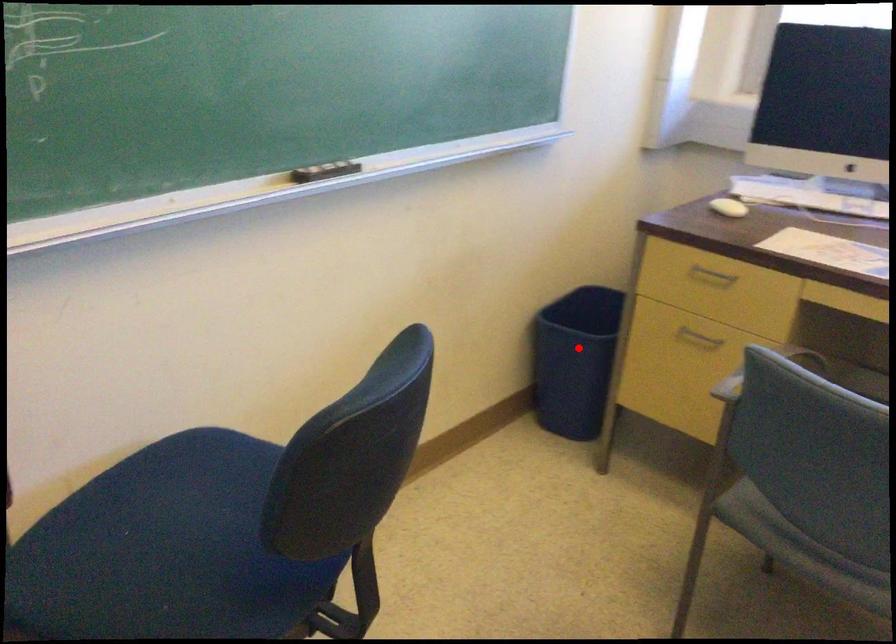
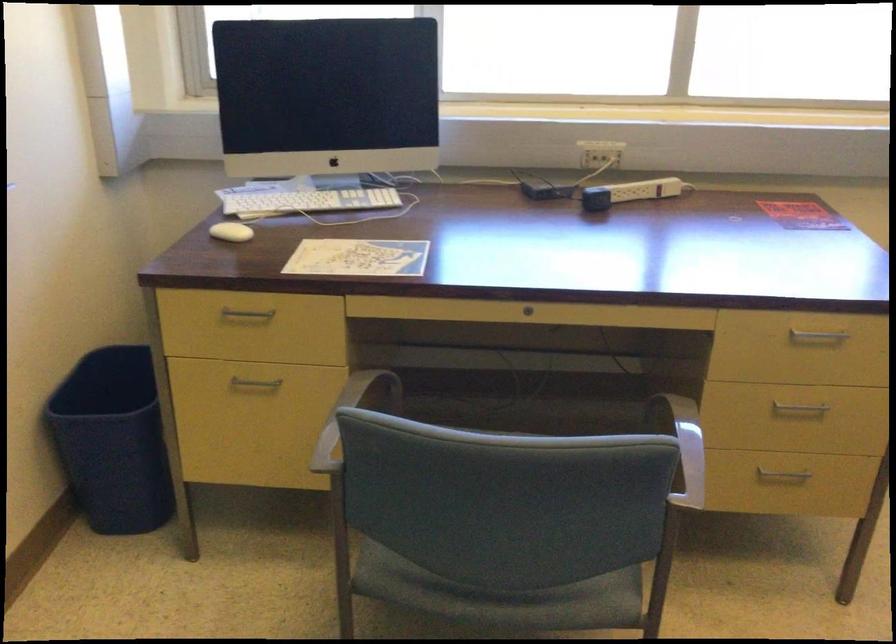
Question: A red point is marked in image1. In image2, is the corresponding 3D point closer to the camera or farther? Reply with the corresponding letter.

Choices:
 (A) The corresponding 3D point is closer.
 (B) The corresponding 3D point is farther.

Answer: (A)